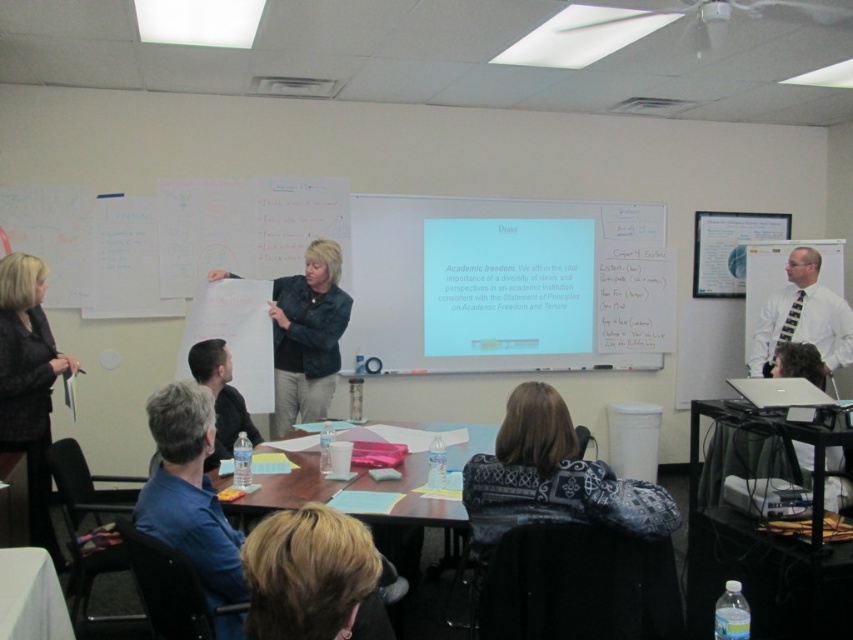
Question: Which object is farther from the camera taking this photo?

Choices:
 (A) denim jacket at center
 (B) white striped tie at upper right
 (C) black textured blazer at left

Answer: (B)

Question: Is black textured blazer at left above white striped tie at upper right?

Choices:
 (A) yes
 (B) no

Answer: (B)

Question: Which object is the closest to the denim jacket at center?

Choices:
 (A) gray fabric shirt at lower left
 (B) blue fabric shirt at lower left
 (C) white striped tie at upper right
 (D) black textured blazer at left

Answer: (A)

Question: Is blonde hair at lower center bigger than blue fabric shirt at lower left?

Choices:
 (A) no
 (B) yes

Answer: (A)

Question: From the image, what is the correct spatial relationship of blue fabric shirt at lower left in relation to black textured blazer at left?

Choices:
 (A) above
 (B) below

Answer: (B)

Question: Which of these objects is positioned farthest from the black textured blazer at left?

Choices:
 (A) blue fabric shirt at lower left
 (B) denim jacket at center
 (C) gray fabric shirt at lower left
 (D) white striped tie at upper right

Answer: (D)